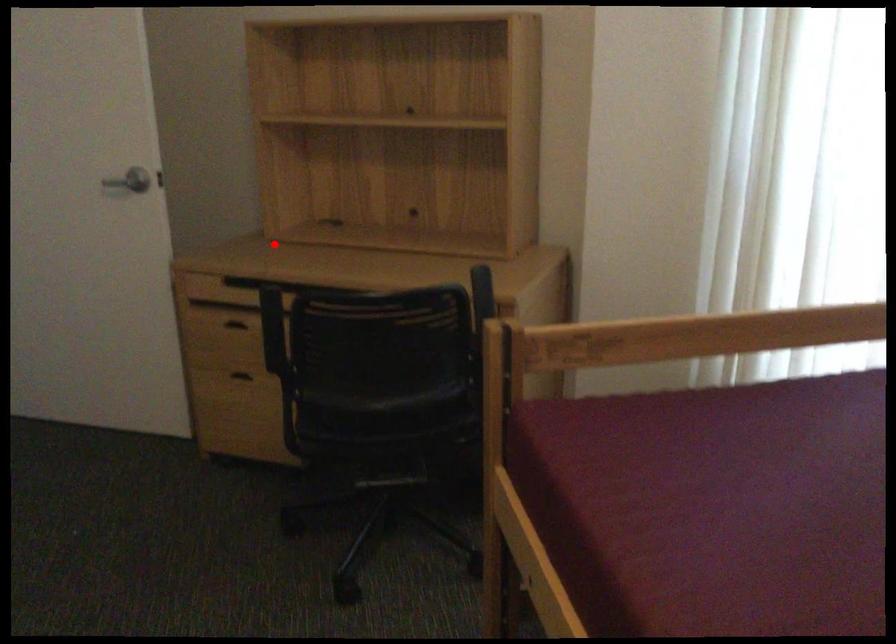
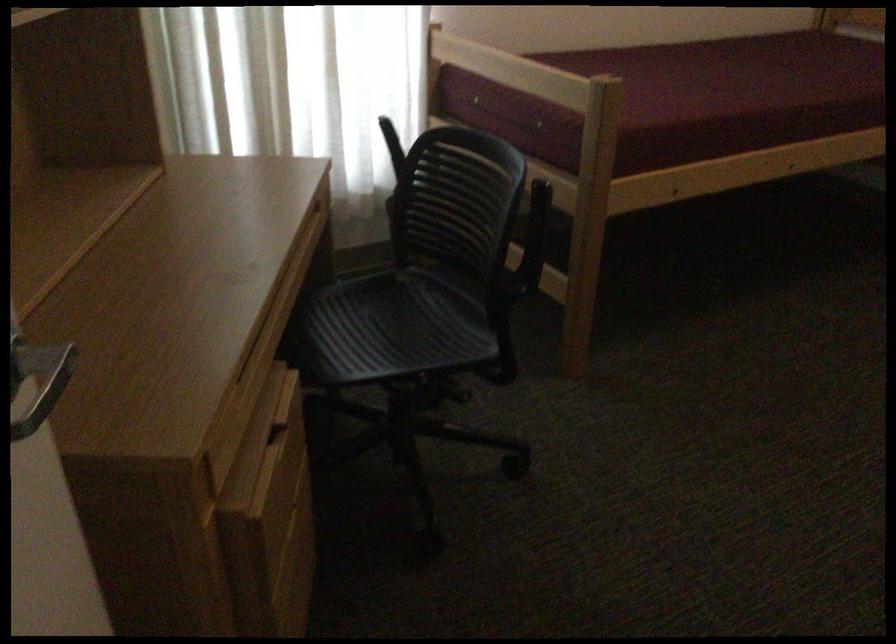
Find the pixel in the second image that matches the highlighted location in the first image.

(55, 380)